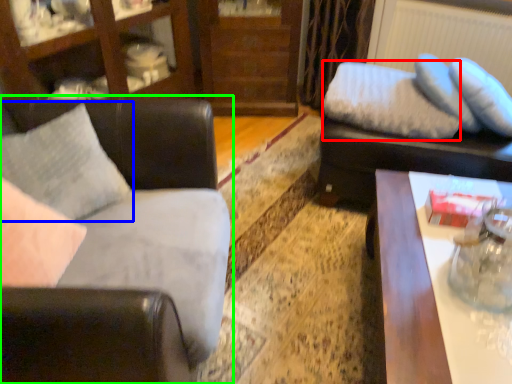
Question: Considering the real-world distances, which object is closest to pillow (highlighted by a red box)? pillow (highlighted by a blue box) or studio couch (highlighted by a green box).

Choices:
 (A) pillow
 (B) studio couch

Answer: (B)